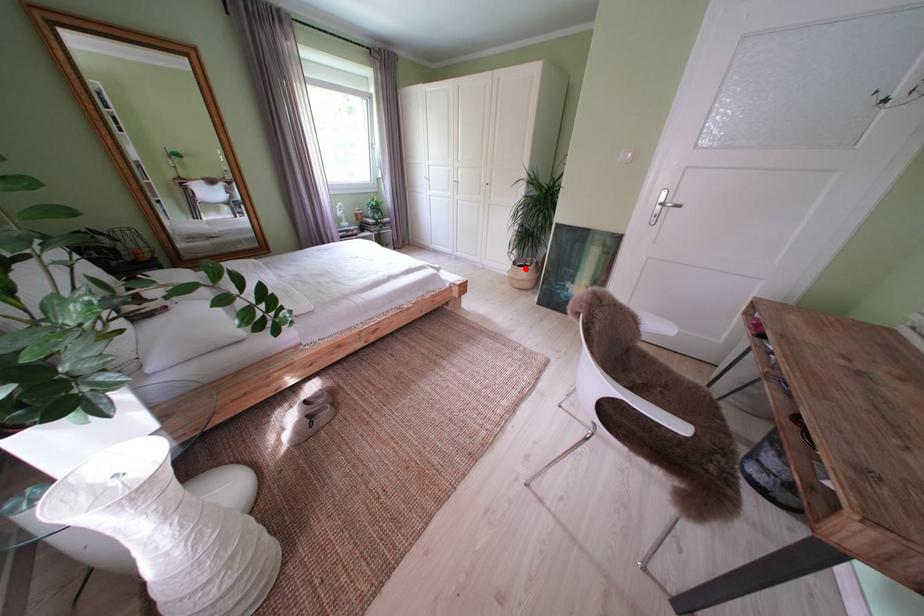
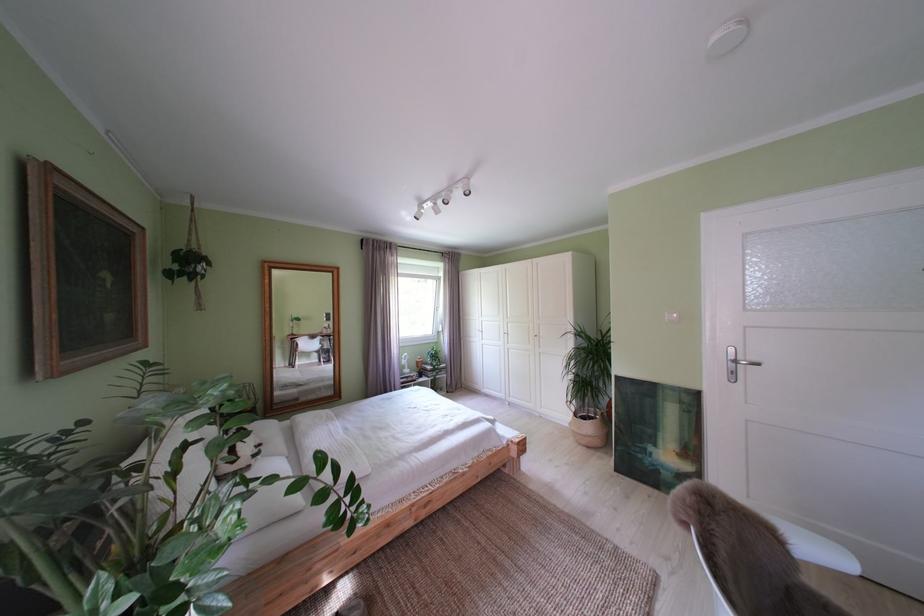
Question: A red point is marked in image1. In image2, is the corresponding 3D point closer to the camera or farther? Reply with the corresponding letter.

Choices:
 (A) The corresponding 3D point is closer.
 (B) The corresponding 3D point is farther.

Answer: (B)